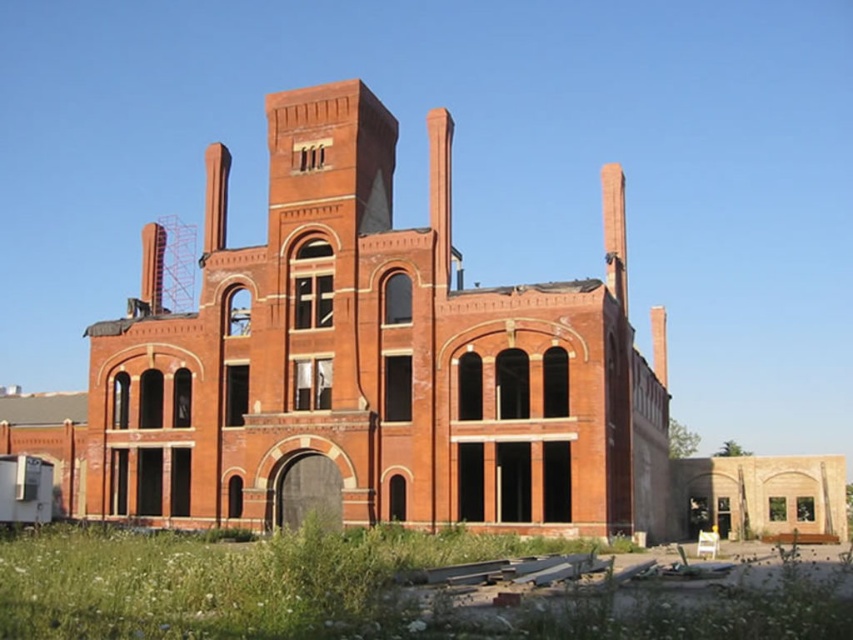
Question: Does red brick building at center have a lesser width compared to green grass at lower left?

Choices:
 (A) yes
 (B) no

Answer: (B)

Question: Which point is farther to the camera?

Choices:
 (A) red brick building at center
 (B) green grass at lower left

Answer: (A)

Question: From the image, what is the correct spatial relationship of red brick building at center in relation to green grass at lower left?

Choices:
 (A) below
 (B) above

Answer: (B)

Question: Which point is farther from the camera taking this photo?

Choices:
 (A) (178, 582)
 (B) (231, 296)

Answer: (B)

Question: Is red brick building at center to the left of green grass at lower left from the viewer's perspective?

Choices:
 (A) yes
 (B) no

Answer: (B)